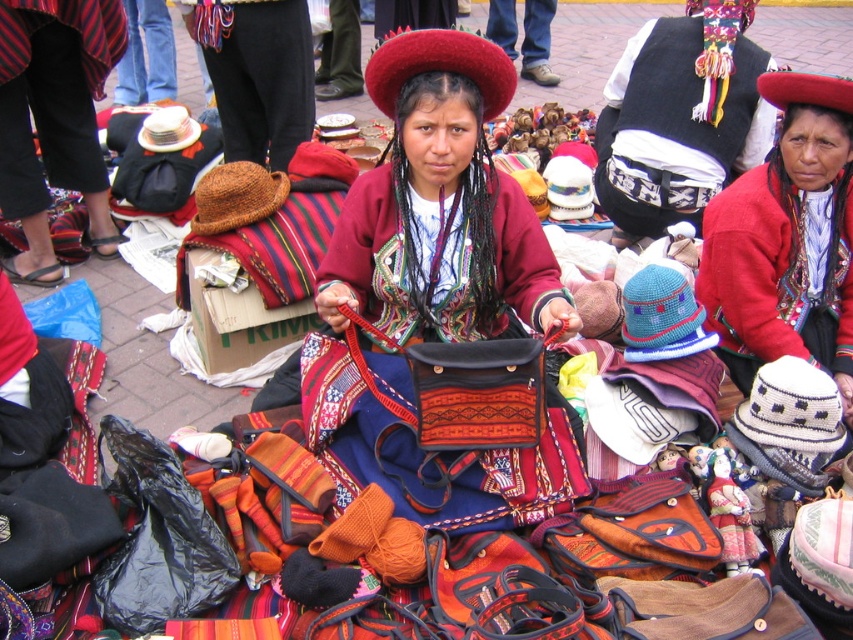
Question: Observing the image, what is the correct spatial positioning of black velvet vest at upper center in reference to matte black bag at center?

Choices:
 (A) right
 (B) left

Answer: (A)

Question: Which of these objects is positioned closest to the black knit hat at upper center?

Choices:
 (A) jeans at center
 (B) matte black bag at center
 (C) knitted wool hat at center

Answer: (B)

Question: Does black velvet vest at upper center lie in front of jeans at center?

Choices:
 (A) yes
 (B) no

Answer: (A)

Question: Which point is closer to the camera?

Choices:
 (A) knitted wool hat at center
 (B) black velvet vest at upper center
 (C) matte black bag at center
 (D) jeans at center

Answer: (C)

Question: Can you confirm if black velvet vest at upper center is positioned to the right of matte black bag at center?

Choices:
 (A) no
 (B) yes

Answer: (B)

Question: Which object appears farthest from the camera in this image?

Choices:
 (A) black knit hat at upper center
 (B) black velvet vest at upper center

Answer: (A)